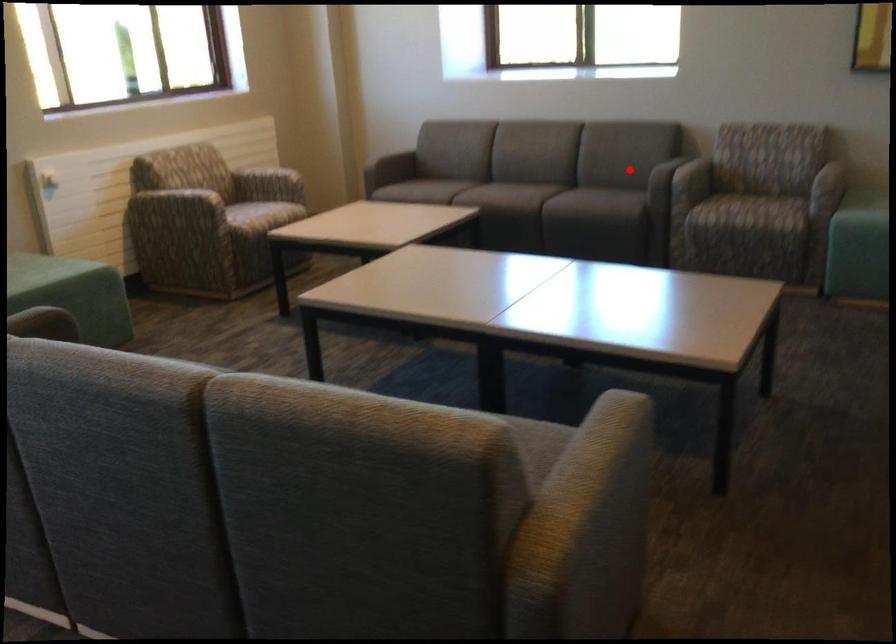
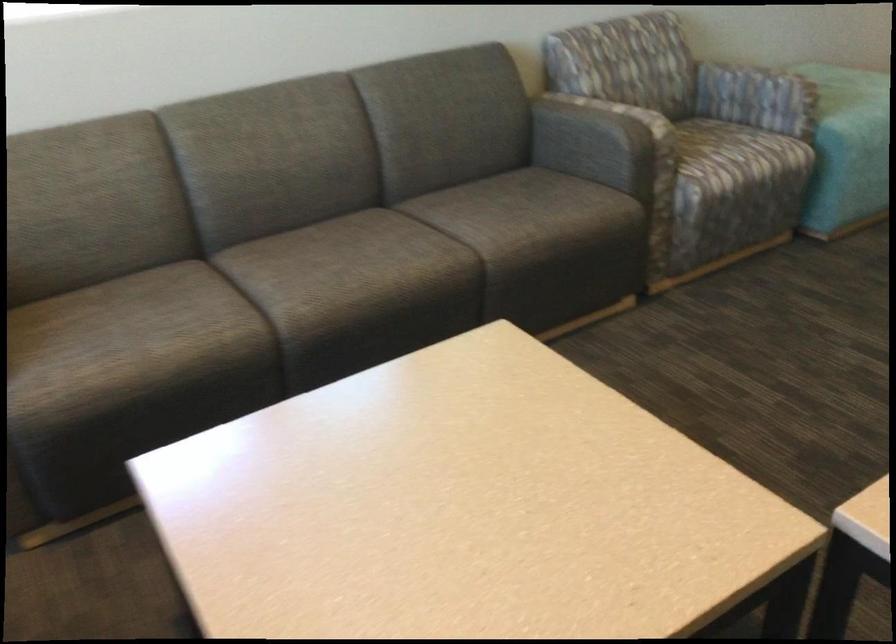
Question: I am providing you with two images of the same scene from different viewpoints. Image1 has a red point marked. In image2, the corresponding 3D location appears at what relative position? Reply with the corresponding letter.

Choices:
 (A) Closer
 (B) Farther

Answer: (A)